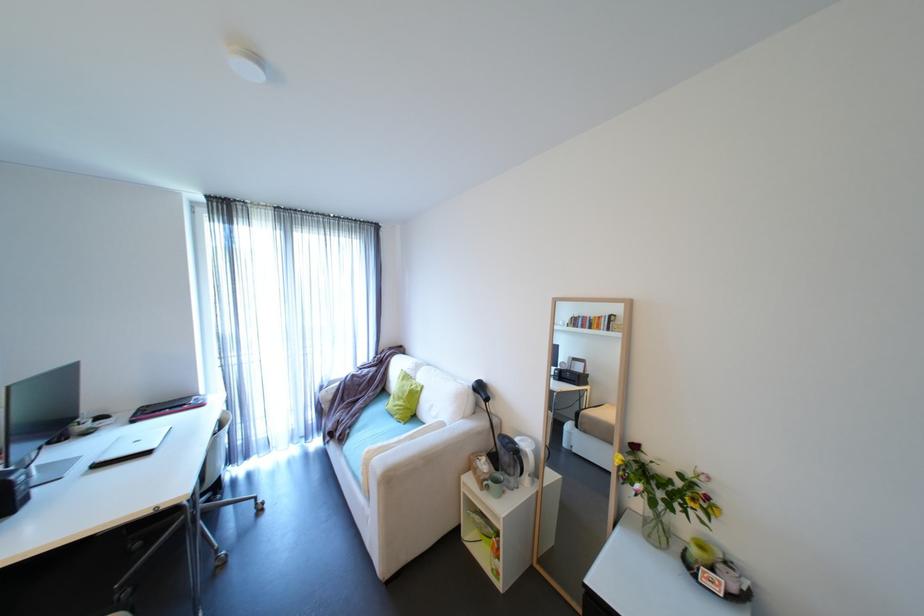
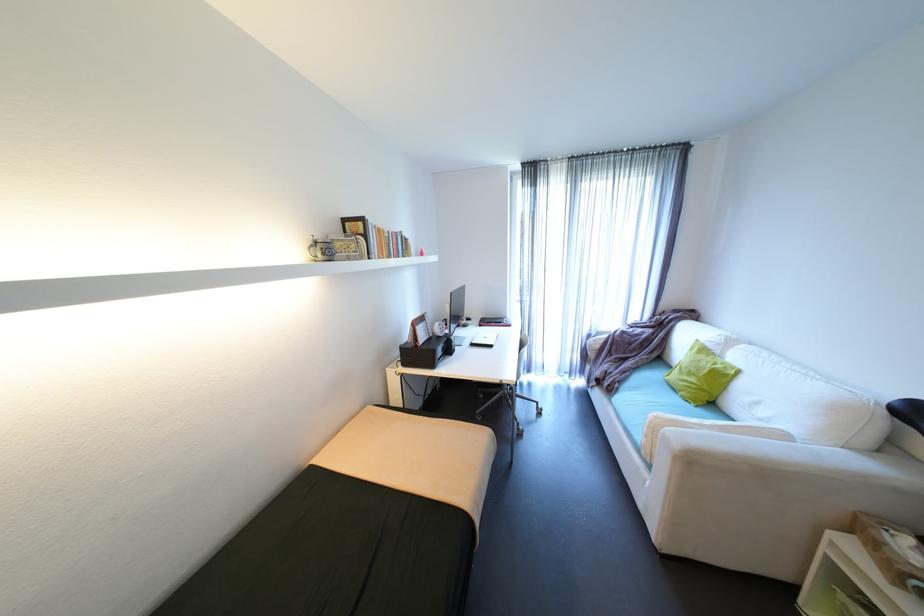
Where in the second image is the point corresponding to pixel 191 405 from the first image?

(508, 323)